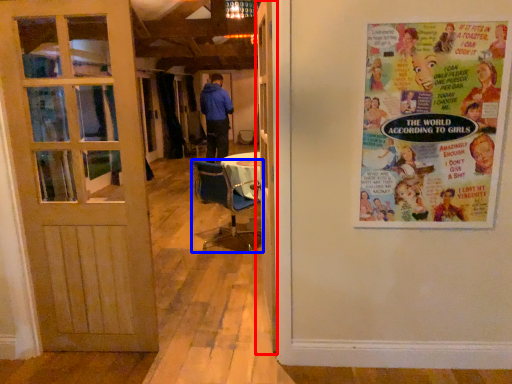
Question: Which of the following is the closest to the observer, door (highlighted by a red box) or chair (highlighted by a blue box)?

Choices:
 (A) door
 (B) chair

Answer: (A)